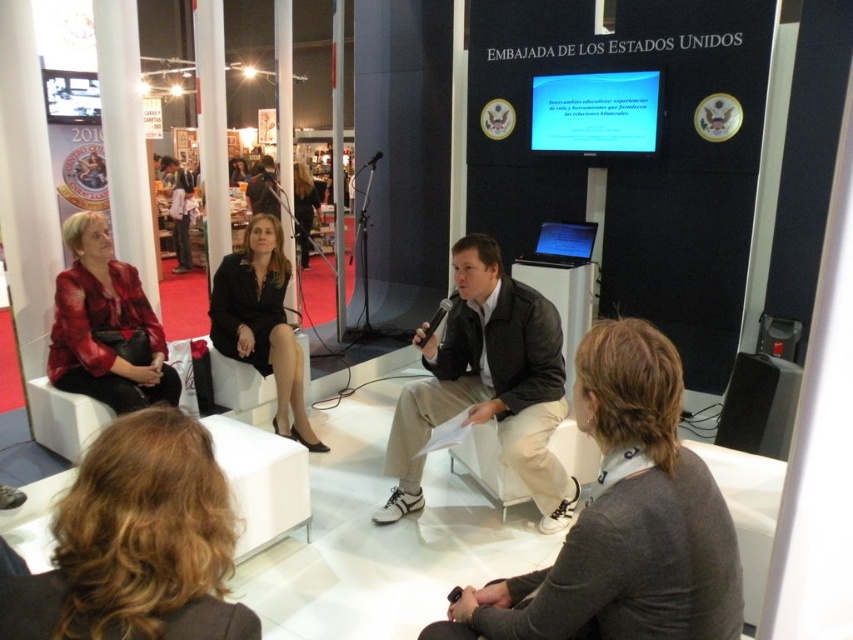
Question: Which object is farther from the camera taking this photo?

Choices:
 (A) blonde hair at lower left
 (B) black leather jacket at center

Answer: (B)

Question: Considering the real-world distances, which object is closest to the black matte speaker at lower right?

Choices:
 (A) matte red jacket at left
 (B) gray sweater at lower center

Answer: (B)

Question: Is black satin dress at center to the left of black matte speaker at lower right from the viewer's perspective?

Choices:
 (A) yes
 (B) no

Answer: (A)

Question: Is gray sweater at lower center thinner than leather jacket at center?

Choices:
 (A) no
 (B) yes

Answer: (B)

Question: Which of the following is the closest to the observer?

Choices:
 (A) (579, 570)
 (B) (152, 353)

Answer: (A)

Question: Can you confirm if blonde hair at lower left is positioned above black matte speaker at lower right?

Choices:
 (A) no
 (B) yes

Answer: (B)